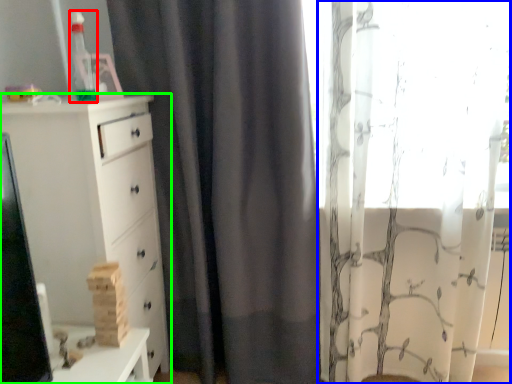
Question: Considering the real-world distances, which object is closest to toy (highlighted by a red box)? curtain (highlighted by a blue box) or chest of drawers (highlighted by a green box).

Choices:
 (A) curtain
 (B) chest of drawers

Answer: (B)